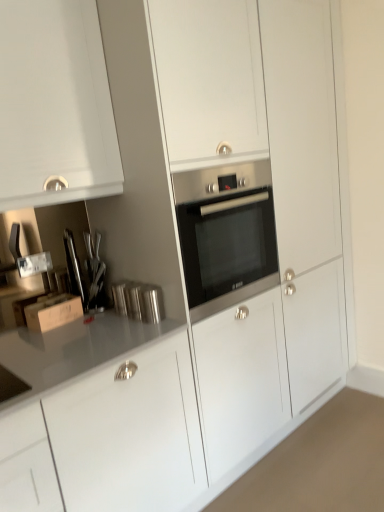
Question: Can you confirm if cardboard box at left is taller than stainless steel oven at center?

Choices:
 (A) yes
 (B) no

Answer: (B)

Question: Considering the relative positions of cardboard box at left and stainless steel oven at center in the image provided, is cardboard box at left to the left of stainless steel oven at center from the viewer's perspective?

Choices:
 (A) yes
 (B) no

Answer: (A)

Question: From a real-world perspective, is cardboard box at left on top of stainless steel oven at center?

Choices:
 (A) yes
 (B) no

Answer: (B)

Question: Is stainless steel oven at center a part of cardboard box at left?

Choices:
 (A) no
 (B) yes

Answer: (A)

Question: From a real-world perspective, is cardboard box at left below stainless steel oven at center?

Choices:
 (A) yes
 (B) no

Answer: (A)

Question: Does cardboard box at left have a smaller size compared to stainless steel oven at center?

Choices:
 (A) no
 (B) yes

Answer: (B)

Question: Is stainless steel oven at center far from cardboard box at left?

Choices:
 (A) no
 (B) yes

Answer: (A)

Question: Can you confirm if stainless steel oven at center is wider than cardboard box at left?

Choices:
 (A) yes
 (B) no

Answer: (A)

Question: From a real-world perspective, is stainless steel oven at center on cardboard box at left?

Choices:
 (A) yes
 (B) no

Answer: (A)

Question: Is stainless steel oven at center further to camera compared to cardboard box at left?

Choices:
 (A) no
 (B) yes

Answer: (A)

Question: Is stainless steel oven at center at the left side of cardboard box at left?

Choices:
 (A) no
 (B) yes

Answer: (A)

Question: Does stainless steel oven at center touch cardboard box at left?

Choices:
 (A) no
 (B) yes

Answer: (A)

Question: Choose the correct answer: Is stainless steel oven at center inside cardboard box at left or outside it?

Choices:
 (A) inside
 (B) outside

Answer: (B)